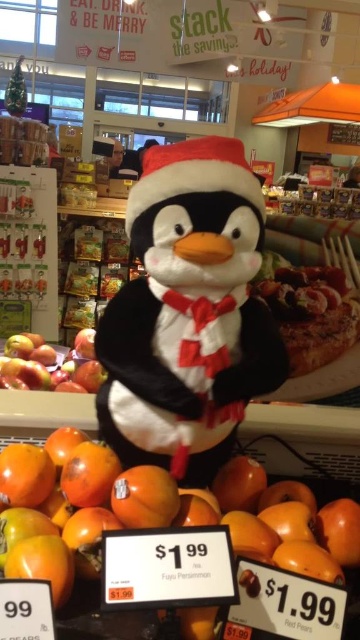
Who is higher up, orange matte fuji persimmon at center or glossy red apple at left?

glossy red apple at left is higher up.

Which is behind, point (263, 502) or point (7, 362)?

The point (7, 362) is more distant.

Locate an element on the screen. orange matte fuji persimmon at center is located at coordinates (158, 513).

Between white plush penguin at center and glossy red apple at left, which one has more height?

white plush penguin at center is taller.

In the scene shown: Can you confirm if white plush penguin at center is smaller than glossy red apple at left?

No.

Is point (169, 456) closer to viewer compared to point (28, 365)?

Yes, it is.

In order to click on white plush penguin at center in this screenshot , I will do `click(187, 314)`.

Between white plush penguin at center and orange matte fuji persimmon at center, which one has more height?

white plush penguin at center is taller.

Does point (155, 378) come in front of point (70, 472)?

That is True.

What do you see at coordinates (187, 314) in the screenshot? This screenshot has height=640, width=360. I see `white plush penguin at center` at bounding box center [187, 314].

Locate an element on the screen. white plush penguin at center is located at coordinates (187, 314).